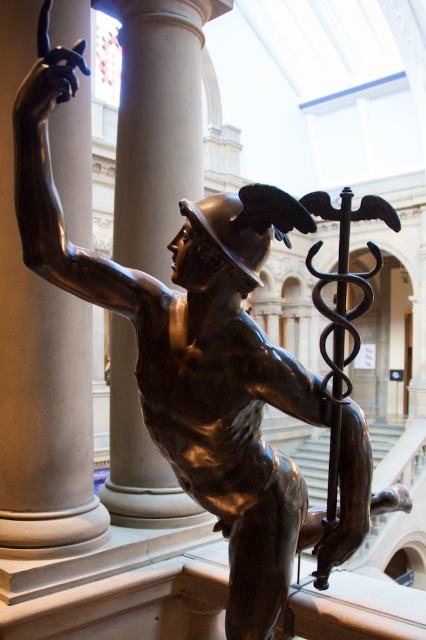
Is matte gray column at left below smooth white column at center?

Indeed, matte gray column at left is positioned under smooth white column at center.

In order to click on matte gray column at left in this screenshot , I will do `click(40, 365)`.

Describe the element at coordinates (40, 365) in the screenshot. I see `matte gray column at left` at that location.

The width and height of the screenshot is (426, 640). I want to click on matte gray column at left, so click(x=40, y=365).